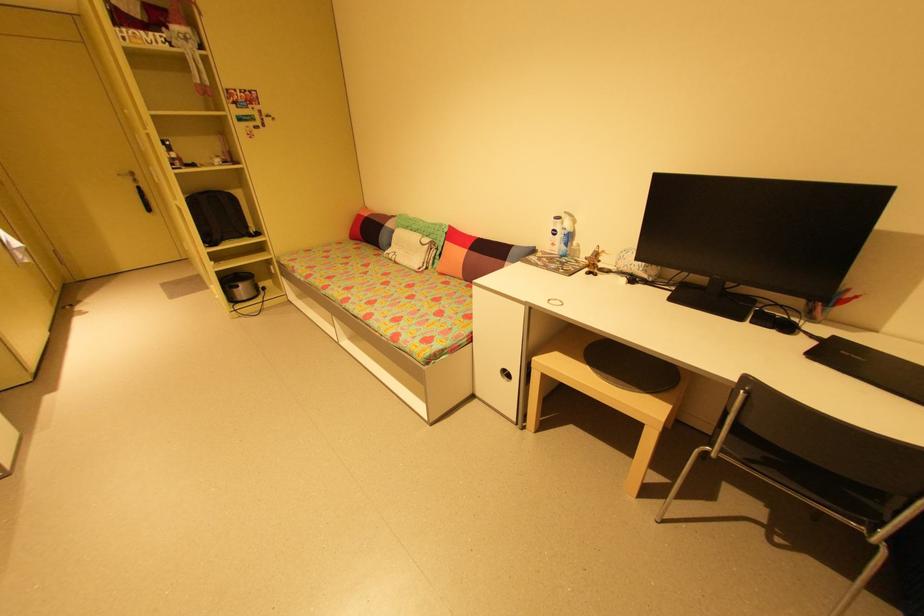
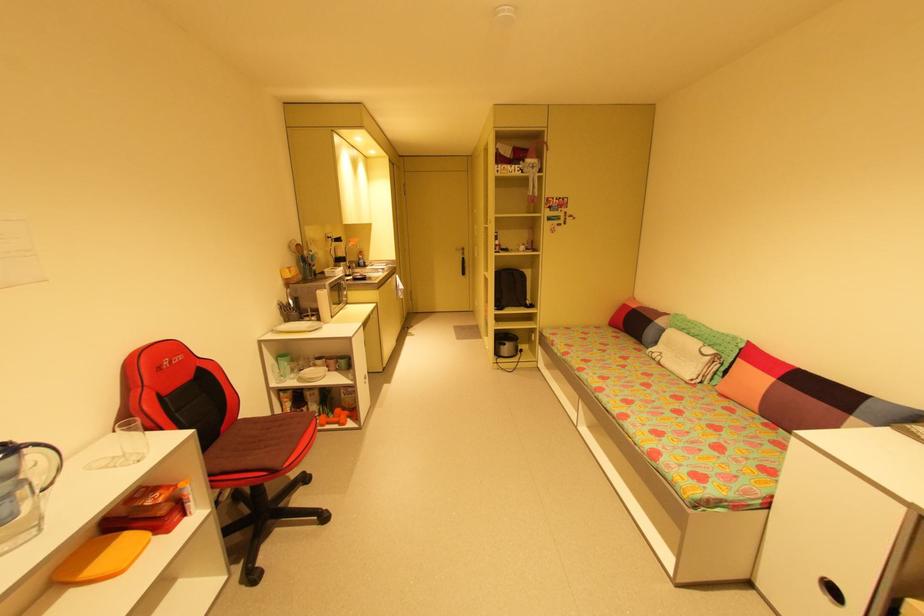
In the second image, find the point that corresponds to the point at 371,322 in the first image.

(625, 422)